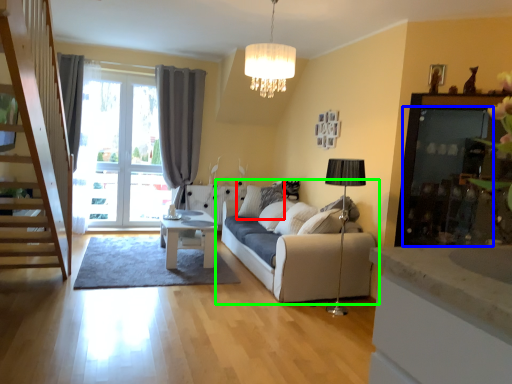
Question: Which is nearer to the pillow (highlighted by a red box)? screen door (highlighted by a blue box) or studio couch (highlighted by a green box).

Choices:
 (A) screen door
 (B) studio couch

Answer: (B)